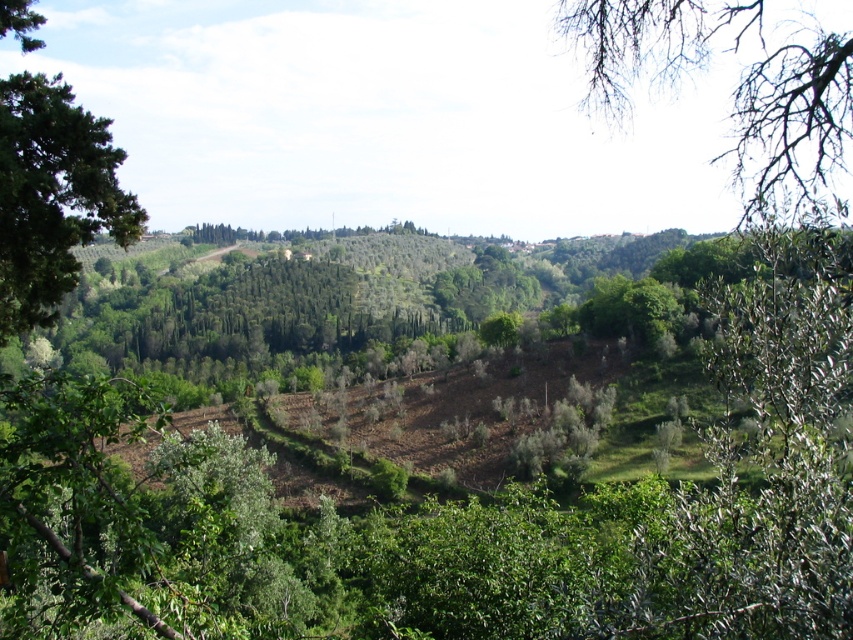
Which is behind, point (589, 13) or point (32, 323)?

Point (589, 13)

Between bare branches at upper right and green leafy tree at left, which one is positioned lower?

green leafy tree at left is lower down.

Find the location of a particular element. bare branches at upper right is located at coordinates (733, 90).

Locate an element on the screen. This screenshot has height=640, width=853. bare branches at upper right is located at coordinates coord(733,90).